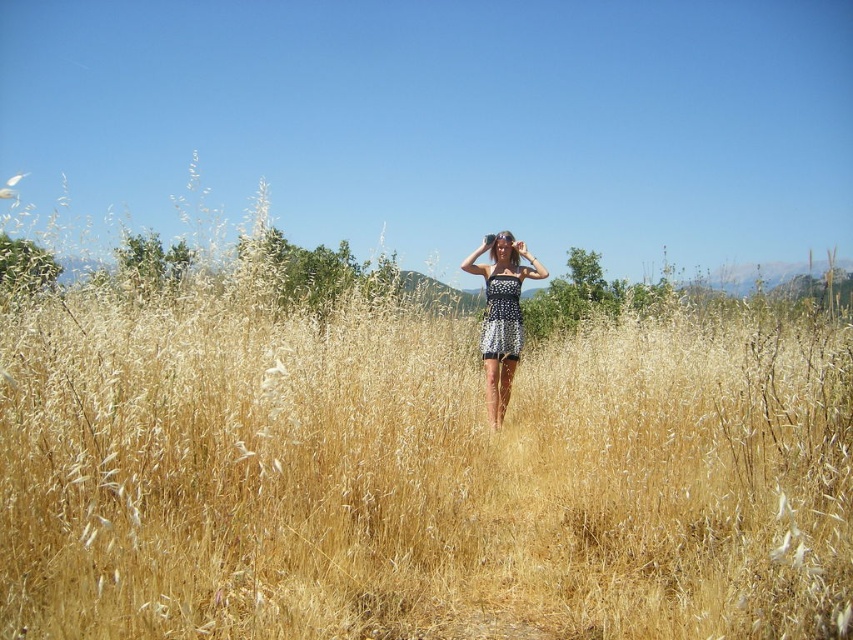
Question: In this image, where is white dotted dress at center located relative to black dotted dress at center?

Choices:
 (A) above
 (B) below

Answer: (B)

Question: Is white dotted dress at center to the left of black dotted dress at center from the viewer's perspective?

Choices:
 (A) yes
 (B) no

Answer: (A)

Question: Among these points, which one is farthest from the camera?

Choices:
 (A) (519, 324)
 (B) (511, 340)

Answer: (A)

Question: Among these objects, which one is nearest to the camera?

Choices:
 (A) white dotted dress at center
 (B) black dotted dress at center

Answer: (A)

Question: Is white dotted dress at center to the right of black dotted dress at center from the viewer's perspective?

Choices:
 (A) yes
 (B) no

Answer: (B)